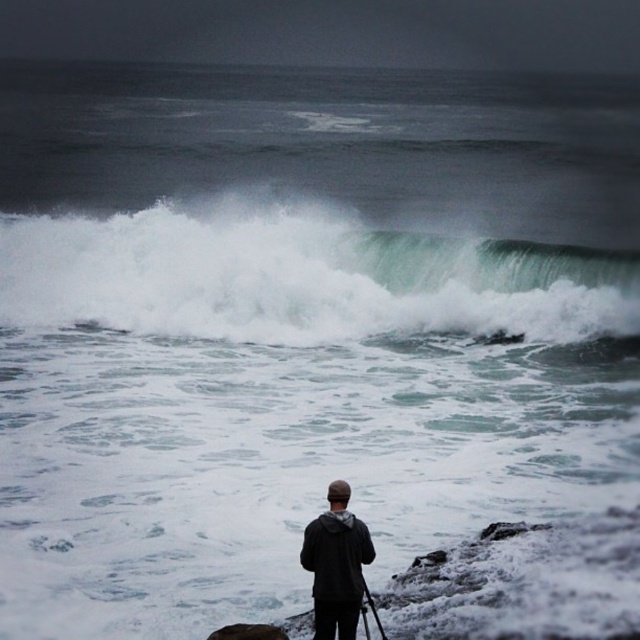
Does point (321, 595) come behind point (364, 593)?

No, (321, 595) is in front of (364, 593).

From the picture: Does dark gray hoodie at center have a larger size compared to black matte tripod at lower center?

Indeed, dark gray hoodie at center has a larger size compared to black matte tripod at lower center.

Is point (346, 548) less distant than point (376, 618)?

Yes, point (346, 548) is in front of point (376, 618).

At what (x,y) coordinates should I click in order to perform the action: click on dark gray hoodie at center. Please return your answer as a coordinate pair (x, y). The width and height of the screenshot is (640, 640). Looking at the image, I should click on (337, 564).

Consider the image. Is white frothy wave at upper center taller than dark gray hoodie at center?

Yes, white frothy wave at upper center is taller than dark gray hoodie at center.

Is white frothy wave at upper center shorter than dark gray hoodie at center?

Incorrect, white frothy wave at upper center's height does not fall short of dark gray hoodie at center's.

Does point (305, 316) come behind point (321, 572)?

Yes, point (305, 316) is behind point (321, 572).

Identify the location of white frothy wave at upper center. (300, 276).

Which is more to the left, white frothy wave at upper center or black matte tripod at lower center?

Positioned to the left is white frothy wave at upper center.

Can you confirm if white frothy wave at upper center is bigger than black matte tripod at lower center?

Indeed, white frothy wave at upper center has a larger size compared to black matte tripod at lower center.

This screenshot has width=640, height=640. I want to click on white frothy wave at upper center, so click(x=300, y=276).